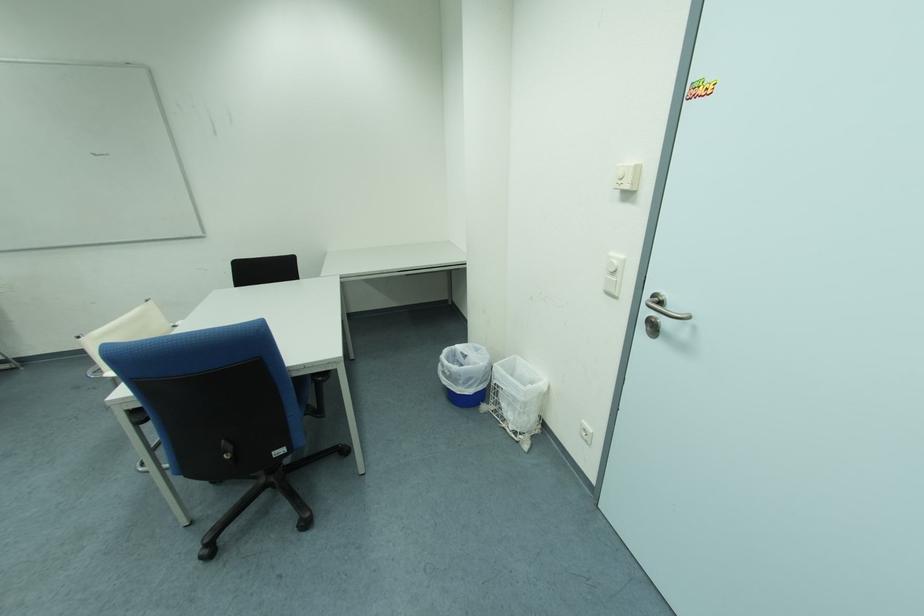
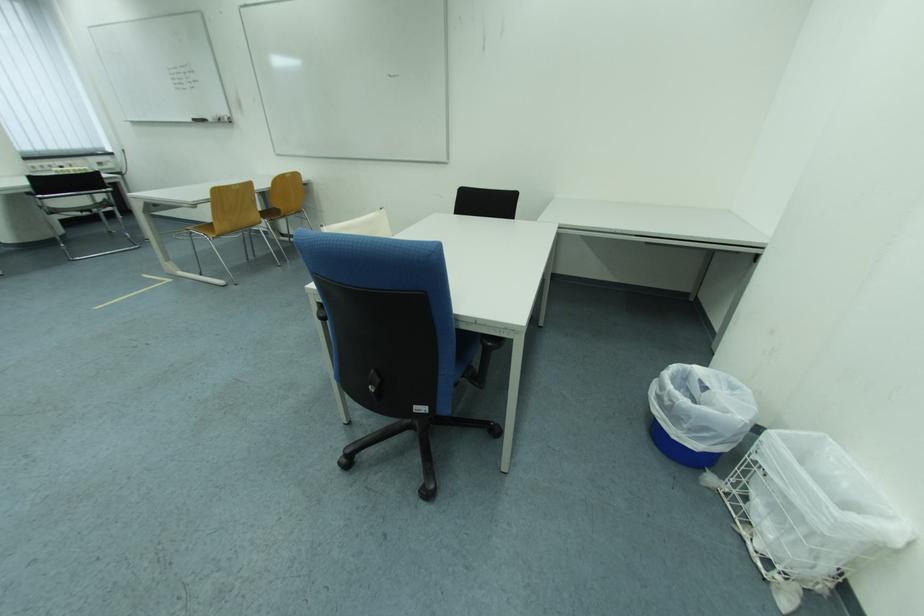
Locate, in the second image, the point that corresponds to pixel 509 428 in the first image.

(745, 532)